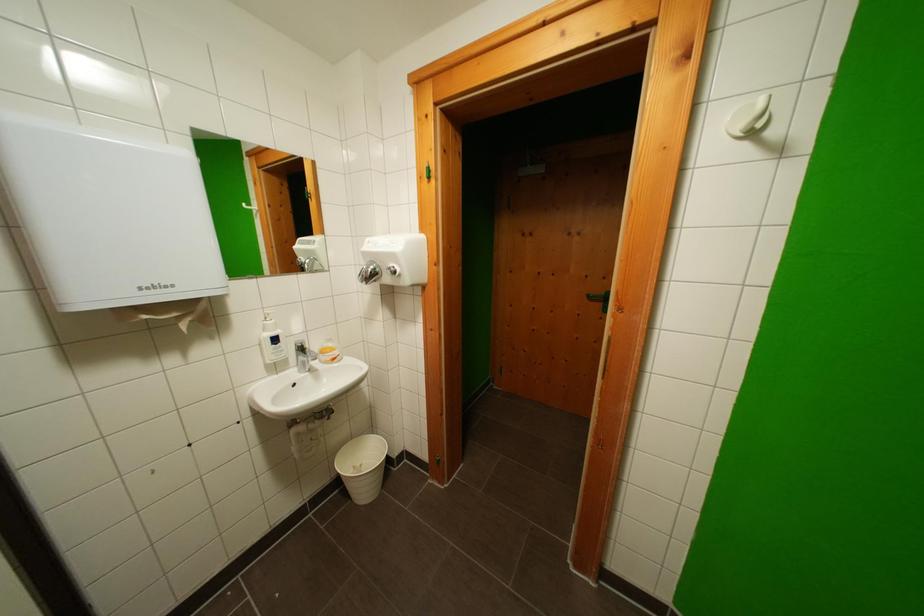
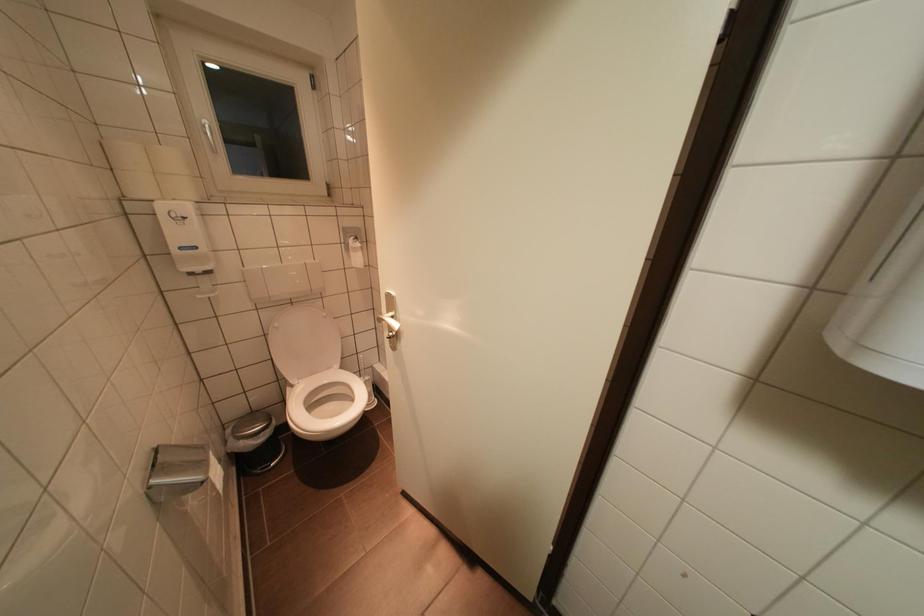
First-person continuous shooting, in which direction is the camera rotating?

The camera's rotation is toward left-down.